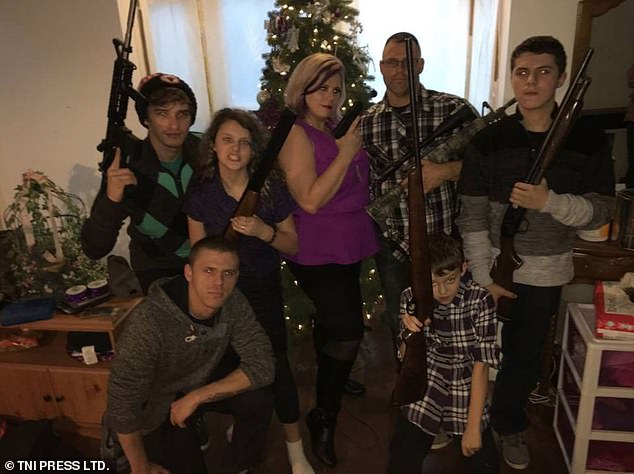
The width and height of the screenshot is (634, 474). Find the location of `sock`. sock is located at coordinates (298, 464).